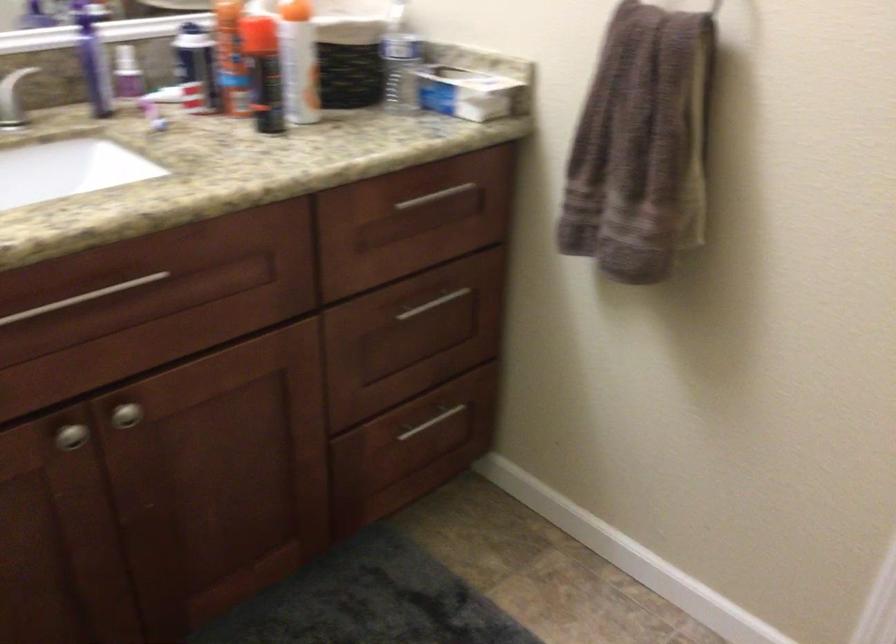
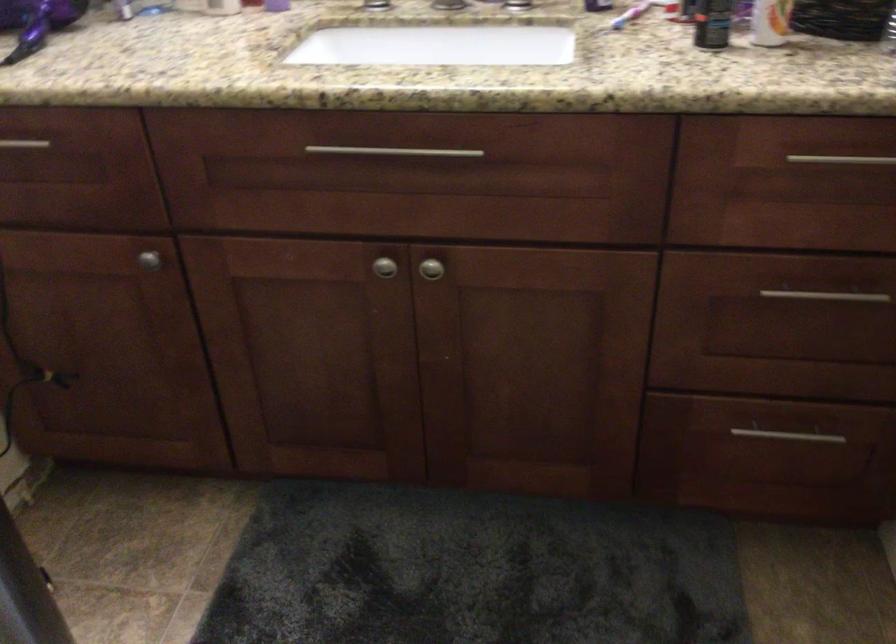
In the second image, find the point that corresponds to the point at 420,436 in the first image.

(778, 446)